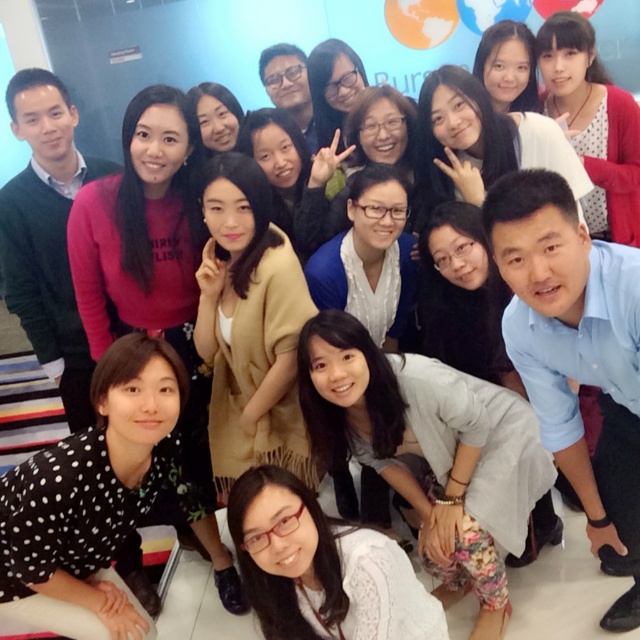
Does blue shirt at lower right appear under white lace blouse at lower center?

Actually, blue shirt at lower right is above white lace blouse at lower center.

Which is in front, point (534, 204) or point (400, 595)?

Point (534, 204) is more forward.

Which is behind, point (566, 220) or point (346, 548)?

Positioned behind is point (346, 548).

Where is `blue shirt at lower right`? This screenshot has height=640, width=640. blue shirt at lower right is located at coordinates (576, 353).

Does gray fabric shirt at lower center lie in front of white lace blouse at lower center?

No, gray fabric shirt at lower center is behind white lace blouse at lower center.

Is gray fabric shirt at lower center above white lace blouse at lower center?

Yes.

Between point (532, 496) and point (268, 620), which one is positioned behind?

The point (532, 496) is more distant.

Find the location of a particular element. gray fabric shirt at lower center is located at coordinates (x=428, y=451).

Does gray fabric shirt at lower center have a greater width compared to blue shirt at lower right?

Indeed, gray fabric shirt at lower center has a greater width compared to blue shirt at lower right.

Which of these two, gray fabric shirt at lower center or blue shirt at lower right, stands shorter?

With less height is gray fabric shirt at lower center.

Which is in front, point (440, 570) or point (541, 435)?

Point (541, 435) is more forward.

Locate an element on the screen. This screenshot has width=640, height=640. gray fabric shirt at lower center is located at coordinates (428, 451).